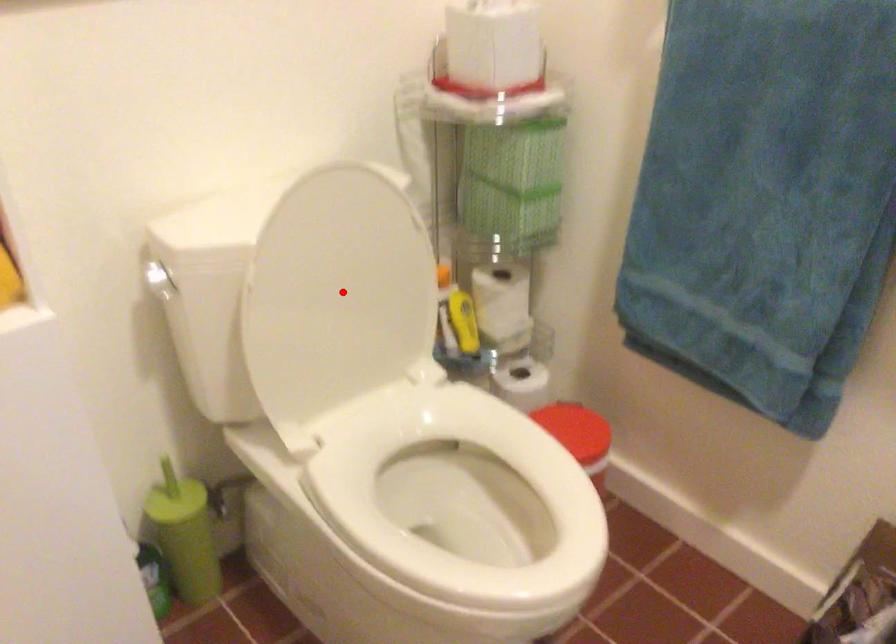
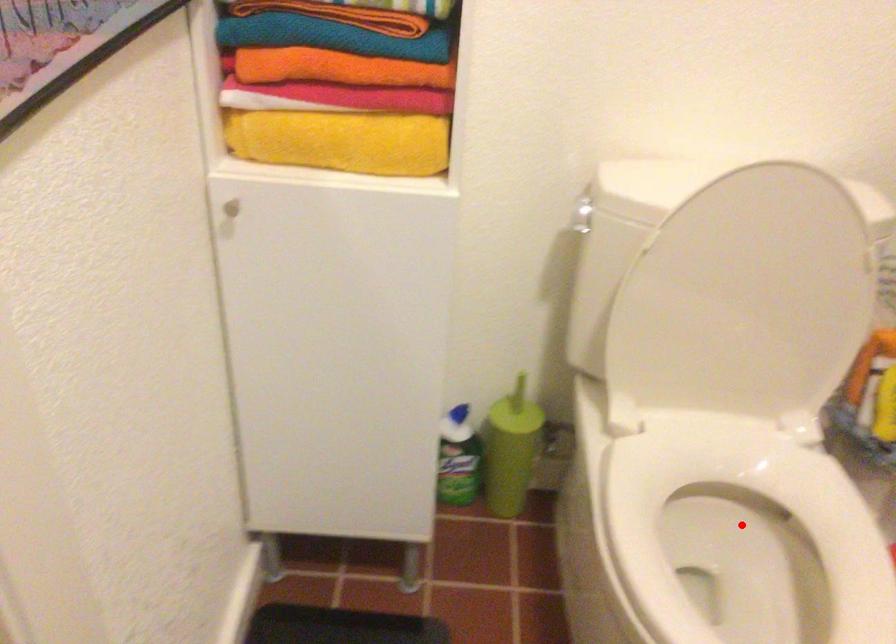
I am providing you with two images of the same scene from different viewpoints. A red point is marked on the first image and another point is marked on the second image. Are the points marked in image1 and image2 representing the same 3D position?

No